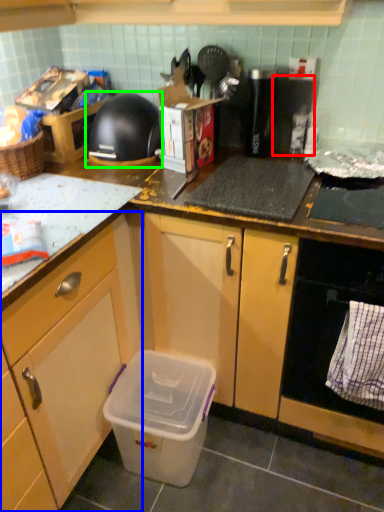
Question: Which object is the farthest from appliance (highlighted by a red box)? Choose among these: cabinetry (highlighted by a blue box) or kitchen appliance (highlighted by a green box).

Choices:
 (A) cabinetry
 (B) kitchen appliance

Answer: (A)